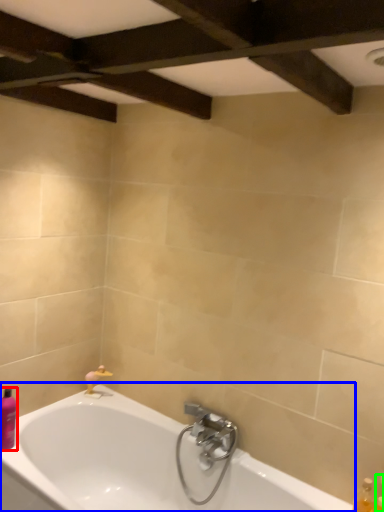
Question: Based on their relative distances, which object is nearer to toiletry (highlighted by a red box)? Choose from bathtub (highlighted by a blue box) and toiletry (highlighted by a green box).

Choices:
 (A) bathtub
 (B) toiletry

Answer: (A)